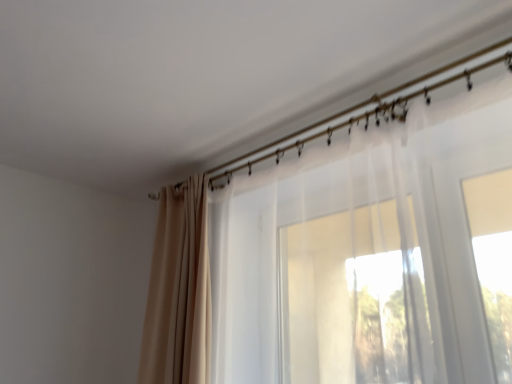
Question: From a real-world perspective, is translucent white curtain at center, the first curtain from the right, under metallic gold curtain rod at upper center?

Choices:
 (A) yes
 (B) no

Answer: (A)

Question: From a real-world perspective, is translucent white curtain at center, acting as the second curtain starting from the left, located higher than metallic gold curtain rod at upper center?

Choices:
 (A) no
 (B) yes

Answer: (A)

Question: From the image's perspective, is translucent white curtain at center, the first curtain from the right, over metallic gold curtain rod at upper center?

Choices:
 (A) yes
 (B) no

Answer: (B)

Question: Does translucent white curtain at center, acting as the second curtain starting from the left, have a larger size compared to metallic gold curtain rod at upper center?

Choices:
 (A) yes
 (B) no

Answer: (A)

Question: Is translucent white curtain at center, acting as the second curtain starting from the left, thinner than metallic gold curtain rod at upper center?

Choices:
 (A) yes
 (B) no

Answer: (B)

Question: Is metallic gold curtain rod at upper center spatially inside translucent white curtain at center, acting as the second curtain starting from the left, or outside of it?

Choices:
 (A) outside
 (B) inside

Answer: (A)

Question: Based on their sizes in the image, would you say metallic gold curtain rod at upper center is bigger or smaller than translucent white curtain at center, the first curtain from the right?

Choices:
 (A) small
 (B) big

Answer: (A)

Question: Does point (332, 130) appear closer or farther from the camera than point (437, 360)?

Choices:
 (A) farther
 (B) closer

Answer: (A)

Question: From a real-world perspective, is metallic gold curtain rod at upper center physically located above or below translucent white curtain at center, acting as the second curtain starting from the left?

Choices:
 (A) below
 (B) above

Answer: (B)

Question: In the image, is beige fabric curtain at upper left, the 2th curtain in the right-to-left sequence, on the left side or the right side of metallic gold curtain rod at upper center?

Choices:
 (A) left
 (B) right

Answer: (A)

Question: In terms of height, does beige fabric curtain at upper left, the 2th curtain in the right-to-left sequence, look taller or shorter compared to metallic gold curtain rod at upper center?

Choices:
 (A) tall
 (B) short

Answer: (A)

Question: Is beige fabric curtain at upper left, which is counted as the 1th curtain, starting from the left, spatially inside metallic gold curtain rod at upper center, or outside of it?

Choices:
 (A) inside
 (B) outside

Answer: (B)

Question: Considering the positions of beige fabric curtain at upper left, which is counted as the 1th curtain, starting from the left, and metallic gold curtain rod at upper center in the image, is beige fabric curtain at upper left, which is counted as the 1th curtain, starting from the left, bigger or smaller than metallic gold curtain rod at upper center?

Choices:
 (A) small
 (B) big

Answer: (B)

Question: Would you say metallic gold curtain rod at upper center is inside or outside beige fabric curtain at upper left, the 2th curtain in the right-to-left sequence?

Choices:
 (A) outside
 (B) inside

Answer: (A)

Question: Is metallic gold curtain rod at upper center wider or thinner than beige fabric curtain at upper left, the 2th curtain in the right-to-left sequence?

Choices:
 (A) thin
 (B) wide

Answer: (A)